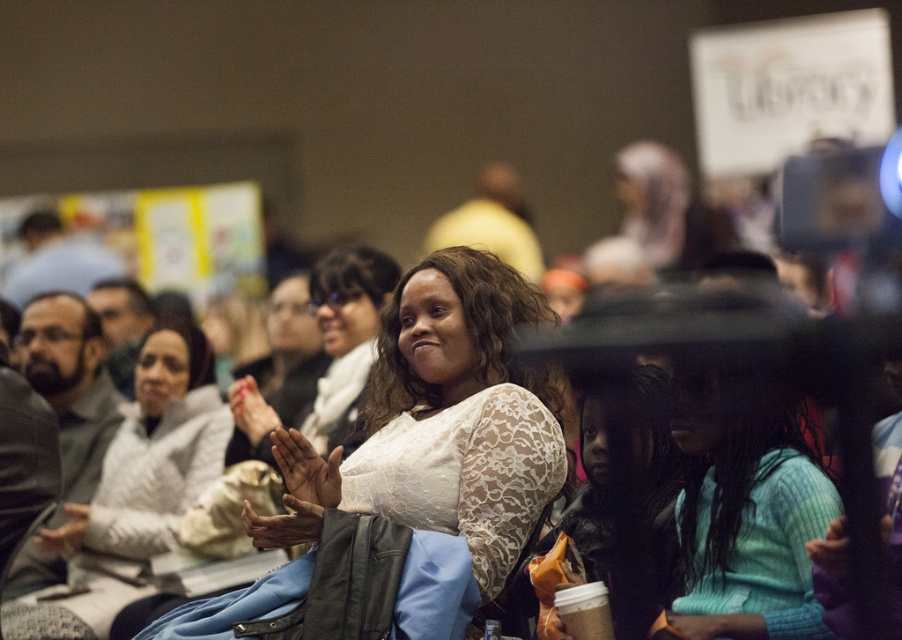
Who is lower down, white lace blouse at center or white lace shirt at center?

white lace shirt at center is lower down.

Does white lace blouse at center come behind white lace shirt at center?

No, it is not.

The width and height of the screenshot is (902, 640). I want to click on white lace blouse at center, so click(449, 417).

Based on the photo, which is below, teal knitted sweater at center or white lace shirt at center?

white lace shirt at center

Who is positioned more to the left, teal knitted sweater at center or white lace shirt at center?

Positioned to the left is white lace shirt at center.

Does point (783, 554) come closer to viewer compared to point (135, 419)?

Yes.

Identify the location of teal knitted sweater at center. The image size is (902, 640). (746, 522).

How distant is white lace blouse at center from teal knitted sweater at center?

29.27 inches

Does white lace blouse at center have a smaller size compared to teal knitted sweater at center?

Incorrect, white lace blouse at center is not smaller in size than teal knitted sweater at center.

Measure the distance between white lace blouse at center and camera.

A distance of 8.32 feet exists between white lace blouse at center and camera.

The width and height of the screenshot is (902, 640). What are the coordinates of `white lace blouse at center` in the screenshot? It's located at (449, 417).